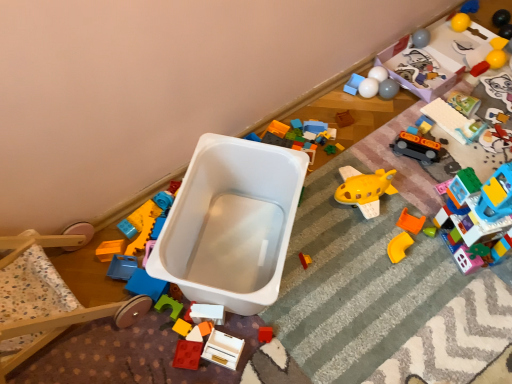
I want to click on vacant area that lies in front of orange matte plastic corner piece at lower right, the eighth toy positioned from the left, so click(410, 305).